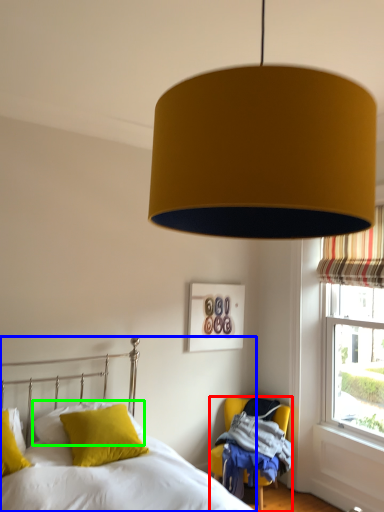
Question: Based on their relative distances, which object is nearer to chair (highlighted by a red box)? Choose from bed (highlighted by a blue box) and pillow (highlighted by a green box).

Choices:
 (A) bed
 (B) pillow

Answer: (B)